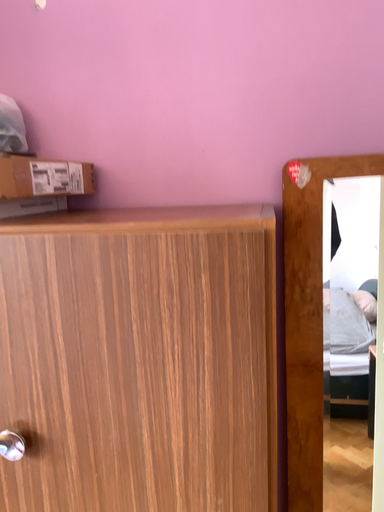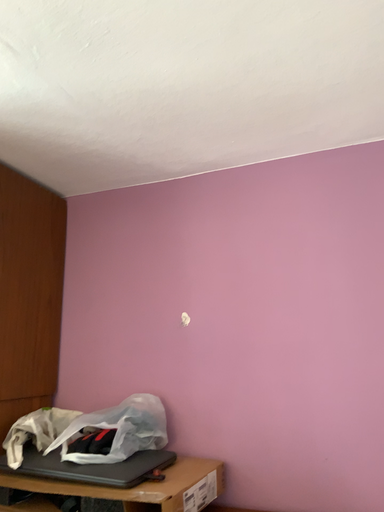
Question: How did the camera likely rotate when shooting the video?

Choices:
 (A) rotated upward
 (B) rotated downward

Answer: (A)